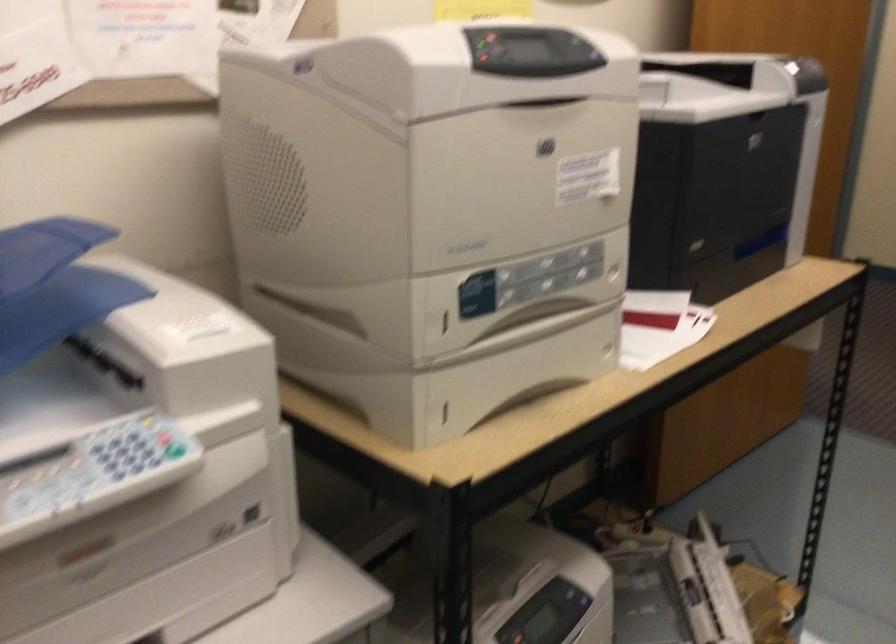
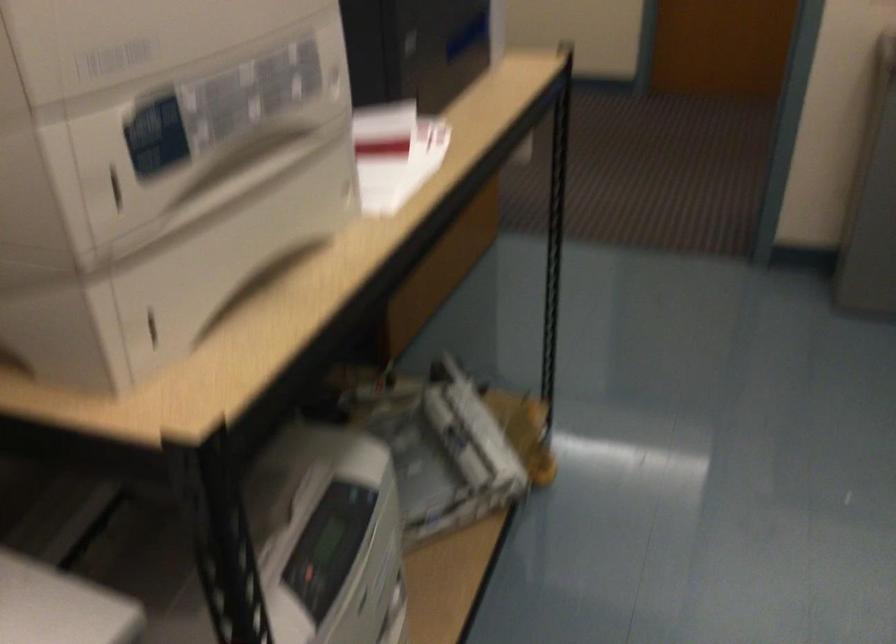
Question: What movement of the cameraman would produce the second image?

Choices:
 (A) Left
 (B) Right
 (C) Forward
 (D) Backward

Answer: (C)